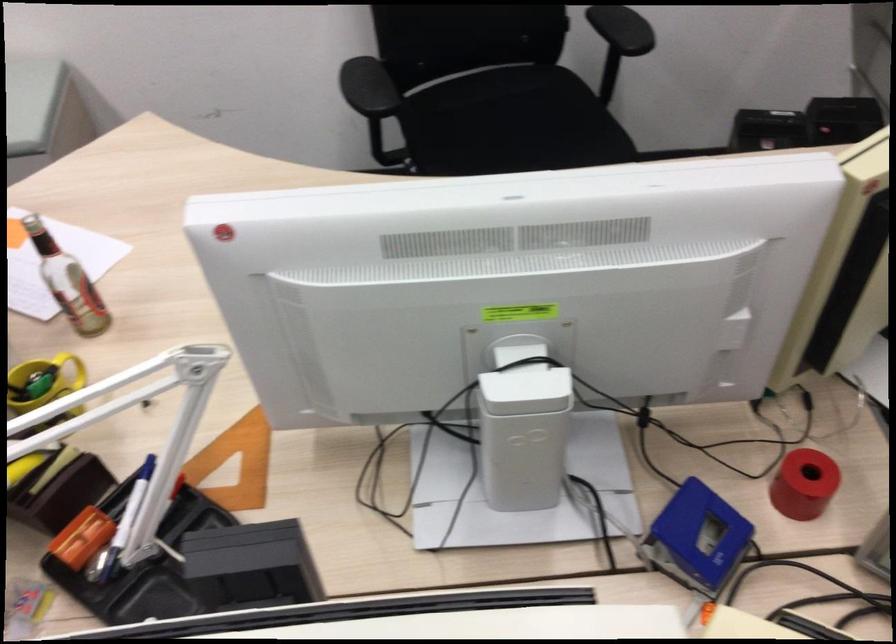
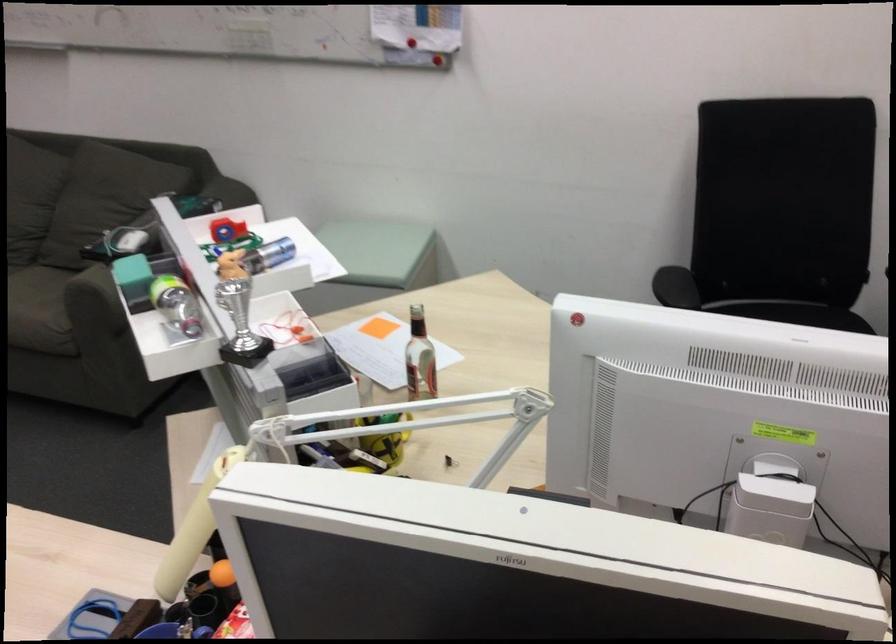
Locate, in the second image, the point that corresponds to the point at 82,286 in the first image.

(419, 359)